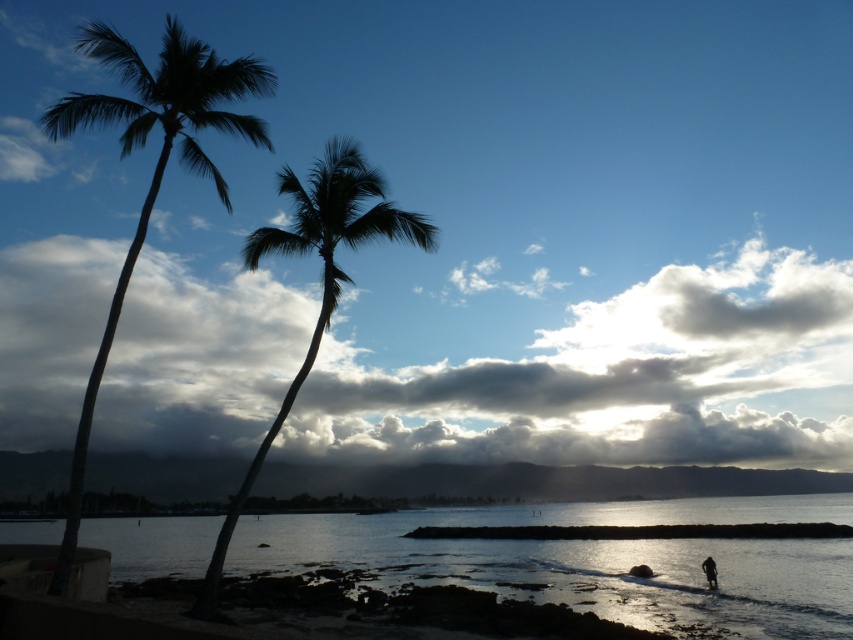
Question: Among these objects, which one is nearest to the camera?

Choices:
 (A) silhouette leafy palm at left
 (B) silhouette leafy palm at center

Answer: (A)

Question: Can you confirm if silhouette leafy palm at left is positioned below silhouette leafy palm at center?

Choices:
 (A) no
 (B) yes

Answer: (A)

Question: Which object is closer to the camera taking this photo?

Choices:
 (A) glistening water at lower center
 (B) silhouette leafy palm at left
 (C) cloudy sky at upper center
 (D) dark skin textured person at lower right

Answer: (B)

Question: Which of these objects is positioned closest to the silhouette leafy palm at center?

Choices:
 (A) silhouette leafy palm at left
 (B) dark skin textured person at lower right
 (C) cloudy sky at upper center
 (D) glistening water at lower center

Answer: (A)

Question: Can you confirm if silhouette leafy palm at left is positioned to the left of dark skin textured person at lower right?

Choices:
 (A) no
 (B) yes

Answer: (B)

Question: Does cloudy sky at upper center appear under dark skin textured person at lower right?

Choices:
 (A) yes
 (B) no

Answer: (B)